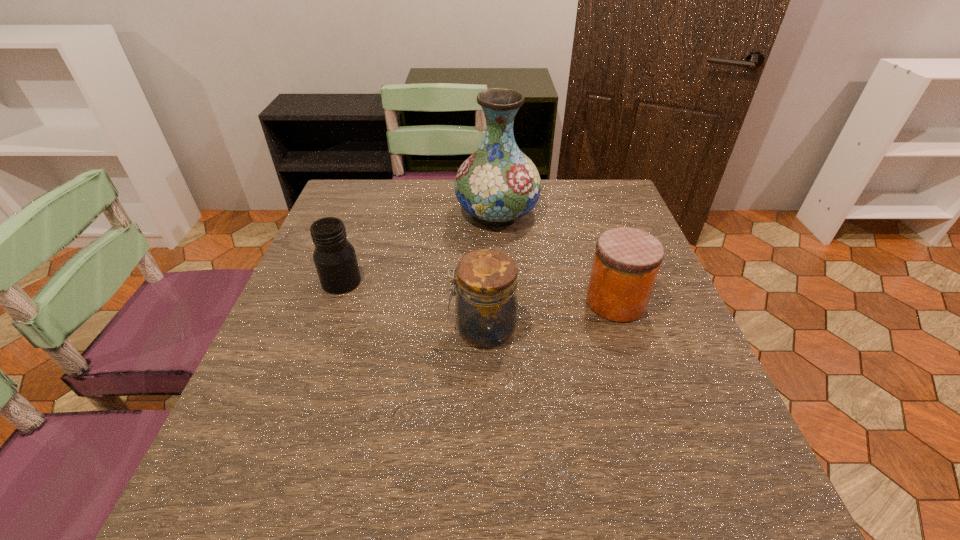
Locate an element on the screen. The width and height of the screenshot is (960, 540). vacant area situated 0.170m on the back of the rightmost object is located at coordinates (594, 239).

Find the location of a particular element. The height and width of the screenshot is (540, 960). object situated at the far edge is located at coordinates (498, 183).

You are a GUI agent. You are given a task and a screenshot of the screen. Output one action in this format:
    pyautogui.click(x=<x>, y=<y>)
    Task: Click on the object that is at the left edge
    The image size is (960, 540).
    Given the screenshot: What is the action you would take?
    pyautogui.click(x=334, y=256)

Identify the location of object that is positioned at the right edge. (626, 263).

Find the location of a particular element. The image size is (960, 540). free space at the far edge is located at coordinates pos(405,187).

The height and width of the screenshot is (540, 960). In the image, there is a desktop. What are the coordinates of `free space at the near edge` in the screenshot? It's located at (357, 502).

Where is `free spot at the left edge of the desktop`? free spot at the left edge of the desktop is located at coordinates (329, 337).

Where is `vacant space at the right edge of the desktop`? This screenshot has height=540, width=960. vacant space at the right edge of the desktop is located at coordinates (594, 250).

Where is `blank space at the far left corner`? The width and height of the screenshot is (960, 540). blank space at the far left corner is located at coordinates (382, 190).

Where is `vacant space at the far right corner`? The height and width of the screenshot is (540, 960). vacant space at the far right corner is located at coordinates (611, 187).